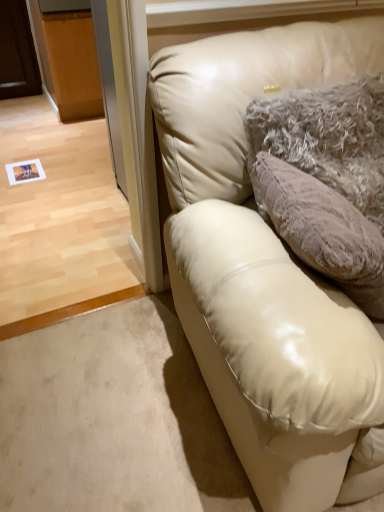
Describe the element at coordinates (265, 268) in the screenshot. This screenshot has width=384, height=512. I see `matte cream leather couch at upper right` at that location.

Where is `matte cream leather couch at upper right`? The width and height of the screenshot is (384, 512). matte cream leather couch at upper right is located at coordinates (265, 268).

Image resolution: width=384 pixels, height=512 pixels. Describe the element at coordinates (326, 140) in the screenshot. I see `fuzzy beige pillow at upper right` at that location.

Based on the photo, what is the approximate height of fuzzy beige pillow at upper right?

19.73 inches.

This screenshot has height=512, width=384. In order to click on fuzzy beige pillow at upper right in this screenshot , I will do `click(326, 140)`.

Measure the distance between fuzzy beige pillow at upper right and camera.

They are 98.65 centimeters apart.

The image size is (384, 512). I want to click on matte cream leather couch at upper right, so click(265, 268).

Considering the relative positions of matte cream leather couch at upper right and fuzzy beige pillow at upper right in the image provided, is matte cream leather couch at upper right to the left or to the right of fuzzy beige pillow at upper right?

Clearly, matte cream leather couch at upper right is on the right of fuzzy beige pillow at upper right in the image.

In the image, is matte cream leather couch at upper right positioned in front of or behind fuzzy beige pillow at upper right?

matte cream leather couch at upper right is positioned closer to the viewer than fuzzy beige pillow at upper right.

Is point (305, 300) positioned before point (335, 88)?

Yes, point (305, 300) is in front of point (335, 88).

From the image's perspective, is matte cream leather couch at upper right beneath fuzzy beige pillow at upper right?

Indeed, from the image's perspective, matte cream leather couch at upper right is shown beneath fuzzy beige pillow at upper right.

From a real-world perspective, does matte cream leather couch at upper right stand above fuzzy beige pillow at upper right?

Incorrect, from a real-world perspective, matte cream leather couch at upper right is lower than fuzzy beige pillow at upper right.

Does matte cream leather couch at upper right have a greater width compared to fuzzy beige pillow at upper right?

Yes.

In terms of height, does matte cream leather couch at upper right look taller or shorter compared to fuzzy beige pillow at upper right?

Clearly, matte cream leather couch at upper right is taller compared to fuzzy beige pillow at upper right.

Does matte cream leather couch at upper right have a smaller size compared to fuzzy beige pillow at upper right?

Incorrect, matte cream leather couch at upper right is not smaller in size than fuzzy beige pillow at upper right.

Can fuzzy beige pillow at upper right be found inside matte cream leather couch at upper right?

Absolutely, fuzzy beige pillow at upper right is inside matte cream leather couch at upper right.

Is matte cream leather couch at upper right directly adjacent to fuzzy beige pillow at upper right?

They are not placed beside each other.

Could you tell me if matte cream leather couch at upper right is facing fuzzy beige pillow at upper right?

Yes, matte cream leather couch at upper right is facing fuzzy beige pillow at upper right.

What's the angular difference between matte cream leather couch at upper right and fuzzy beige pillow at upper right's facing directions?

There is a 2.78-degree angle between the facing directions of matte cream leather couch at upper right and fuzzy beige pillow at upper right.

The width and height of the screenshot is (384, 512). In order to click on pillow to the left of matte cream leather couch at upper right in this screenshot , I will do `click(326, 140)`.

Considering the relative positions of fuzzy beige pillow at upper right and matte cream leather couch at upper right in the image provided, is fuzzy beige pillow at upper right to the left or to the right of matte cream leather couch at upper right?

fuzzy beige pillow at upper right is positioned on matte cream leather couch at upper right's left side.

Relative to matte cream leather couch at upper right, is fuzzy beige pillow at upper right in front or behind?

fuzzy beige pillow at upper right is behind matte cream leather couch at upper right.

Considering the positions of point (266, 108) and point (317, 329), is point (266, 108) closer or farther from the camera than point (317, 329)?

Point (266, 108) is positioned farther from the camera compared to point (317, 329).

From the image's perspective, which is above, fuzzy beige pillow at upper right or matte cream leather couch at upper right?

fuzzy beige pillow at upper right, from the image's perspective.

In the scene shown: From a real-world perspective, does fuzzy beige pillow at upper right stand above matte cream leather couch at upper right?

Yes, from a real-world perspective, fuzzy beige pillow at upper right is on top of matte cream leather couch at upper right.

Looking at their sizes, would you say fuzzy beige pillow at upper right is wider or thinner than matte cream leather couch at upper right?

fuzzy beige pillow at upper right is thinner than matte cream leather couch at upper right.

Considering the sizes of objects fuzzy beige pillow at upper right and matte cream leather couch at upper right in the image provided, who is taller, fuzzy beige pillow at upper right or matte cream leather couch at upper right?

matte cream leather couch at upper right.

Considering the sizes of objects fuzzy beige pillow at upper right and matte cream leather couch at upper right in the image provided, who is smaller, fuzzy beige pillow at upper right or matte cream leather couch at upper right?

Answer: fuzzy beige pillow at upper right is smaller.

Is matte cream leather couch at upper right a part of fuzzy beige pillow at upper right?

No, matte cream leather couch at upper right is located outside of fuzzy beige pillow at upper right.

In the scene shown: Is fuzzy beige pillow at upper right far away from matte cream leather couch at upper right?

Actually, fuzzy beige pillow at upper right and matte cream leather couch at upper right are a little close together.

Is fuzzy beige pillow at upper right oriented away from matte cream leather couch at upper right?

Yes, matte cream leather couch at upper right is at the back of fuzzy beige pillow at upper right.

How different are the orientations of fuzzy beige pillow at upper right and matte cream leather couch at upper right in degrees?

They differ by 2.78 degrees in their facing directions.

Measure the distance between fuzzy beige pillow at upper right and matte cream leather couch at upper right.

They are 8.63 inches apart.

Locate an element on the screen. This screenshot has width=384, height=512. pillow behind the matte cream leather couch at upper right is located at coordinates (326, 140).

Where is `pillow above the matte cream leather couch at upper right (from a real-world perspective)`? This screenshot has height=512, width=384. pillow above the matte cream leather couch at upper right (from a real-world perspective) is located at coordinates (326, 140).

Image resolution: width=384 pixels, height=512 pixels. Identify the location of studio couch lying in front of the fuzzy beige pillow at upper right. (265, 268).